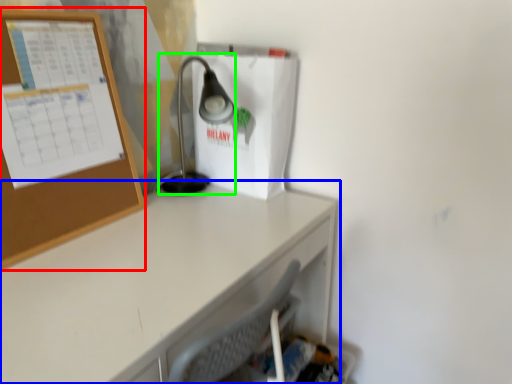
Question: Estimate the real-world distances between objects in this image. Which object is farther from bulletin board (highlighted by a red box), desk (highlighted by a blue box) or lamp (highlighted by a green box)?

Choices:
 (A) desk
 (B) lamp

Answer: (B)